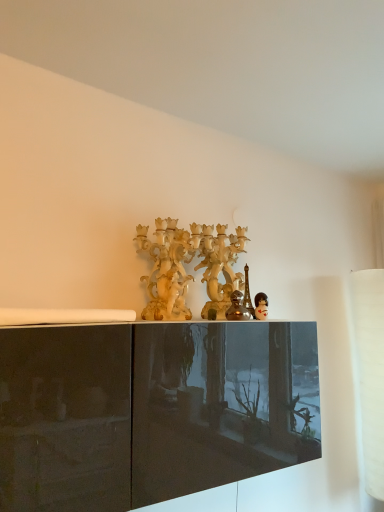
Question: From the image's perspective, would you say matte black doll at center is shown under metallic silver figurine at center?

Choices:
 (A) yes
 (B) no

Answer: (A)

Question: Considering the relative positions of matte black doll at center and metallic silver figurine at center in the image provided, is matte black doll at center to the left of metallic silver figurine at center from the viewer's perspective?

Choices:
 (A) no
 (B) yes

Answer: (A)

Question: Is matte black doll at center smaller than metallic silver figurine at center?

Choices:
 (A) yes
 (B) no

Answer: (A)

Question: Is matte black doll at center positioned with its back to metallic silver figurine at center?

Choices:
 (A) no
 (B) yes

Answer: (A)

Question: Is matte black doll at center at the right side of metallic silver figurine at center?

Choices:
 (A) no
 (B) yes

Answer: (B)

Question: From a real-world perspective, is matte cream candelabra at center above or below metallic silver figurine at center?

Choices:
 (A) above
 (B) below

Answer: (A)

Question: From the image's perspective, is matte cream candelabra at center located above or below metallic silver figurine at center?

Choices:
 (A) above
 (B) below

Answer: (A)

Question: Is matte cream candelabra at center spatially inside metallic silver figurine at center, or outside of it?

Choices:
 (A) inside
 (B) outside

Answer: (B)

Question: In terms of width, does matte cream candelabra at center look wider or thinner when compared to metallic silver figurine at center?

Choices:
 (A) wide
 (B) thin

Answer: (A)

Question: From the image's perspective, is metallic silver figurine at center located above or below matte black doll at center?

Choices:
 (A) above
 (B) below

Answer: (A)

Question: From a real-world perspective, is metallic silver figurine at center positioned above or below matte black doll at center?

Choices:
 (A) above
 (B) below

Answer: (A)

Question: Considering their positions, is metallic silver figurine at center located in front of or behind matte black doll at center?

Choices:
 (A) front
 (B) behind

Answer: (A)

Question: Is metallic silver figurine at center taller or shorter than matte black doll at center?

Choices:
 (A) short
 (B) tall

Answer: (B)

Question: Based on their sizes in the image, would you say metallic silver figurine at center is bigger or smaller than matte cream candelabra at center?

Choices:
 (A) big
 (B) small

Answer: (B)

Question: From the image's perspective, relative to matte cream candelabra at center, is metallic silver figurine at center above or below?

Choices:
 (A) above
 (B) below

Answer: (B)